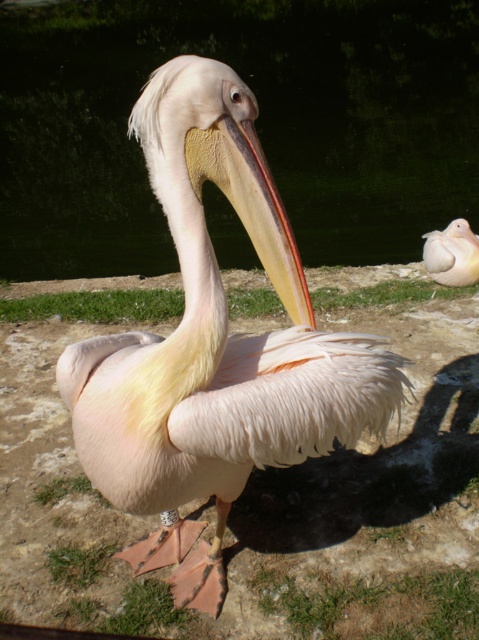
Question: In this image, where is white feathered pelican at center located relative to matte pink pelican at right?

Choices:
 (A) right
 (B) left

Answer: (B)

Question: Which object is farther from the camera taking this photo?

Choices:
 (A) transparent water at center
 (B) yellowish matte beak at center
 (C) white feathered pelican at center

Answer: (A)

Question: Can you confirm if white feathered pelican at center is positioned above yellowish matte beak at center?

Choices:
 (A) no
 (B) yes

Answer: (A)

Question: Which of the following is the closest to the observer?

Choices:
 (A) yellowish matte beak at center
 (B) matte pink pelican at right
 (C) white feathered pelican at center
 (D) transparent water at center

Answer: (C)

Question: Which point is farther to the camera?

Choices:
 (A) (225, 136)
 (B) (236, 160)
 (C) (371, 124)

Answer: (C)

Question: In this image, where is transparent water at center located relative to white feathered pelican at center?

Choices:
 (A) below
 (B) above

Answer: (B)